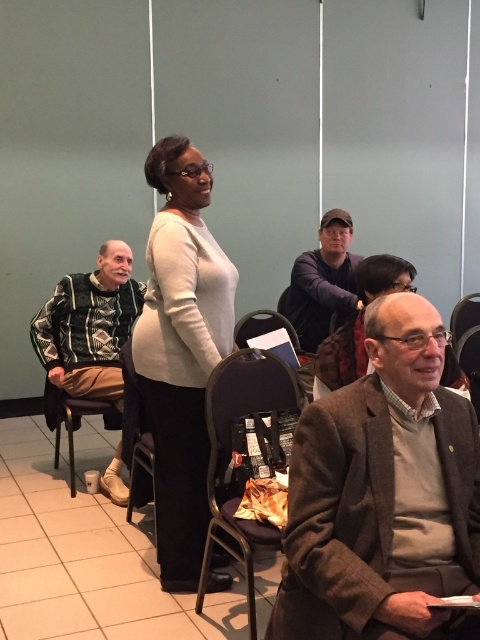
You are attending a meeting and need to sit down. You see a black fabric chair at center and a white plastic chair at lower left. Which chair is located closer to the front of the room?

The white plastic chair at lower left is closer to the front of the room because it is positioned under the black fabric chair at center, indicating it is in front.